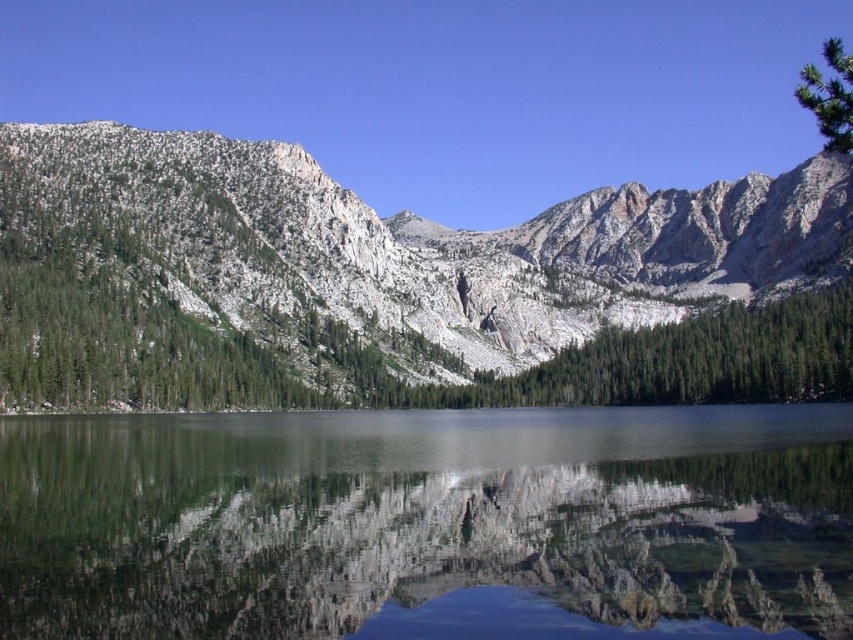
Question: Does green textured mountain at center appear on the left side of clear glass water at center?

Choices:
 (A) no
 (B) yes

Answer: (A)

Question: Which of the following is the closest to the observer?

Choices:
 (A) green textured mountain at center
 (B) clear glass water at center

Answer: (B)

Question: Does green textured mountain at center come in front of clear glass water at center?

Choices:
 (A) yes
 (B) no

Answer: (B)

Question: Can you confirm if green textured mountain at center is thinner than clear glass water at center?

Choices:
 (A) yes
 (B) no

Answer: (B)

Question: Which of the following is the closest to the observer?

Choices:
 (A) (108, 349)
 (B) (730, 410)

Answer: (A)